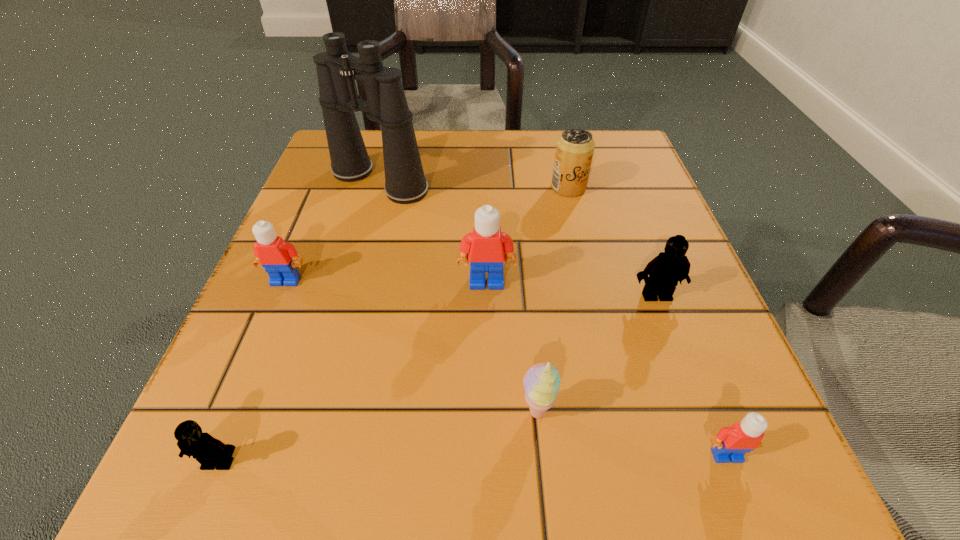
This screenshot has height=540, width=960. I want to click on binoculars, so click(405, 183).

You are a GUI agent. You are given a task and a screenshot of the screen. Output one action in this format:
    pyautogui.click(x=<x>, y=<y>)
    Task: Click on the third Lego from right to left
    Image resolution: width=960 pixels, height=540 pixels.
    Given the screenshot: What is the action you would take?
    pyautogui.click(x=486, y=249)

Locate an element on the screen. This screenshot has height=540, width=960. the second white Lego from left to right is located at coordinates click(486, 249).

The height and width of the screenshot is (540, 960). What are the coordinates of `the sixth object from left to right` in the screenshot? It's located at (574, 150).

Image resolution: width=960 pixels, height=540 pixels. I want to click on the farther black Lego, so click(665, 270).

Locate an element on the screen. This screenshot has width=960, height=540. the right black Lego is located at coordinates (665, 270).

I want to click on the second biggest white Lego, so click(x=274, y=254).

Where is `sherbert`? sherbert is located at coordinates (541, 382).

The height and width of the screenshot is (540, 960). Identify the location of the nearer black Lego. (208, 451).

You are a GUI agent. You are given a task and a screenshot of the screen. Output one action in this format:
    pyautogui.click(x=<x>, y=<y>)
    Task: Click on the left black Lego
    This screenshot has height=540, width=960.
    Given the screenshot: What is the action you would take?
    pyautogui.click(x=208, y=451)